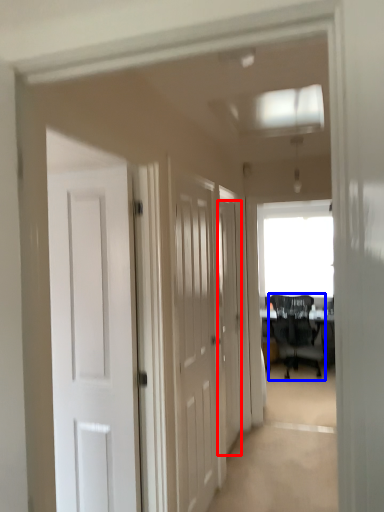
Question: Which point is closer to the camera, door (highlighted by a red box) or chair (highlighted by a blue box)?

Choices:
 (A) door
 (B) chair

Answer: (A)